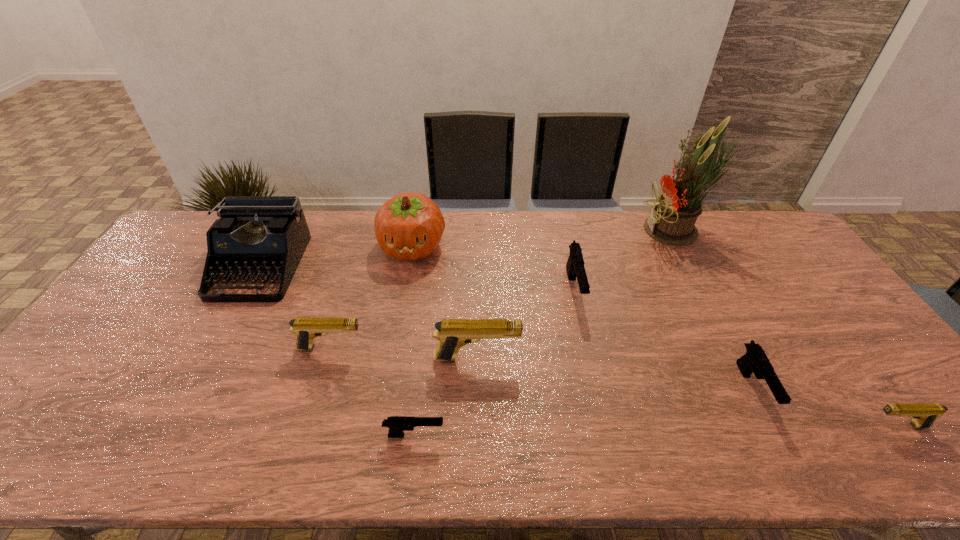
You are a GUI agent. You are given a task and a screenshot of the screen. Output one action in this format:
    pyautogui.click(x=<x>, y=<y>)
    Task: Click on the pistol that can be found as the fifth closest to the biggest tan pistol
    The height and width of the screenshot is (540, 960).
    Given the screenshot: What is the action you would take?
    pyautogui.click(x=924, y=415)

Locate an element on the screen. This screenshot has height=540, width=960. pistol object that ranks as the sixth closest to the flower arrangement is located at coordinates (306, 329).

Identify the location of the second closest tan pistol relative to the fifth pistol from left to right. (452, 334).

Where is `tan pistol that is the closest to the leftmost tan pistol`? This screenshot has height=540, width=960. tan pistol that is the closest to the leftmost tan pistol is located at coordinates (452, 334).

At what (x,y) coordinates should I click in order to perform the action: click on black pistol that is the second closest to the second tan pistol from left to right. Please return your answer as a coordinate pair (x, y). Looking at the image, I should click on (575, 267).

Identify which black pistol is the nearest to the smallest tan pistol. Please provide its 2D coordinates. Your answer should be formatted as a tuple, i.e. [(x, y)], where the tuple contains the x and y coordinates of a point satisfying the conditions above.

[(755, 360)]

I want to click on vacant space that satisfies the following two spatial constraints: 1. on the front-facing side of the farthest pistol; 2. at the barrel of the second nearest tan pistol, so click(x=589, y=359).

This screenshot has height=540, width=960. In order to click on free point that satisfies the following two spatial constraints: 1. in front of the tallest object with the fan visible; 2. on the front-facing side of the second black pistol from right to left in this screenshot , I will do `click(708, 289)`.

Locate an element on the screen. The image size is (960, 540). free spot that satisfies the following two spatial constraints: 1. on the front-facing side of the third pistol from right to left; 2. on the front-facing side of the smallest black pistol is located at coordinates (607, 435).

Identify the location of vacant area in the image that satisfies the following two spatial constraints: 1. on the front-facing side of the second farthest black pistol; 2. on the front-facing side of the nearest black pistol. The width and height of the screenshot is (960, 540). (777, 435).